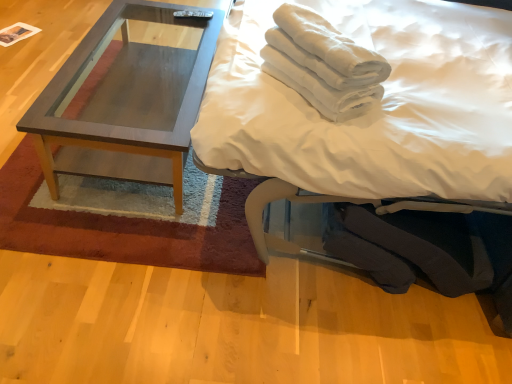
Question: From the image's perspective, is matte wood coffee table at left over white soft bed at upper right?

Choices:
 (A) yes
 (B) no

Answer: (A)

Question: Does matte wood coffee table at left have a larger size compared to white soft bed at upper right?

Choices:
 (A) no
 (B) yes

Answer: (A)

Question: Is the position of matte wood coffee table at left less distant than that of white soft bed at upper right?

Choices:
 (A) yes
 (B) no

Answer: (B)

Question: From a real-world perspective, is matte wood coffee table at left over white soft bed at upper right?

Choices:
 (A) yes
 (B) no

Answer: (B)

Question: Considering the relative sizes of matte wood coffee table at left and white soft bed at upper right in the image provided, is matte wood coffee table at left wider than white soft bed at upper right?

Choices:
 (A) no
 (B) yes

Answer: (A)

Question: Does matte wood coffee table at left have a smaller size compared to white soft bed at upper right?

Choices:
 (A) no
 (B) yes

Answer: (B)

Question: Is matte wood coffee table at left aimed at wooden coffee table at center?

Choices:
 (A) no
 (B) yes

Answer: (A)

Question: Is wooden coffee table at center a part of matte wood coffee table at left?

Choices:
 (A) yes
 (B) no

Answer: (B)

Question: Considering the relative sizes of matte wood coffee table at left and wooden coffee table at center in the image provided, is matte wood coffee table at left bigger than wooden coffee table at center?

Choices:
 (A) no
 (B) yes

Answer: (B)

Question: Is matte wood coffee table at left to the right of wooden coffee table at center from the viewer's perspective?

Choices:
 (A) no
 (B) yes

Answer: (A)

Question: Is matte wood coffee table at left positioned in front of wooden coffee table at center?

Choices:
 (A) yes
 (B) no

Answer: (A)

Question: Can you confirm if matte wood coffee table at left is smaller than wooden coffee table at center?

Choices:
 (A) yes
 (B) no

Answer: (B)

Question: Is wooden coffee table at center closer to camera compared to white cotton towels at upper right?

Choices:
 (A) no
 (B) yes

Answer: (A)